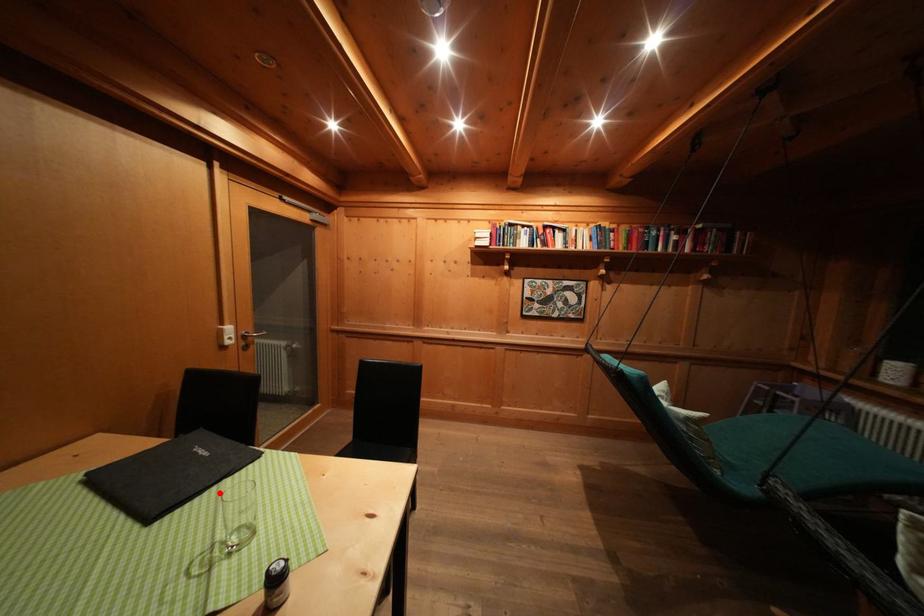
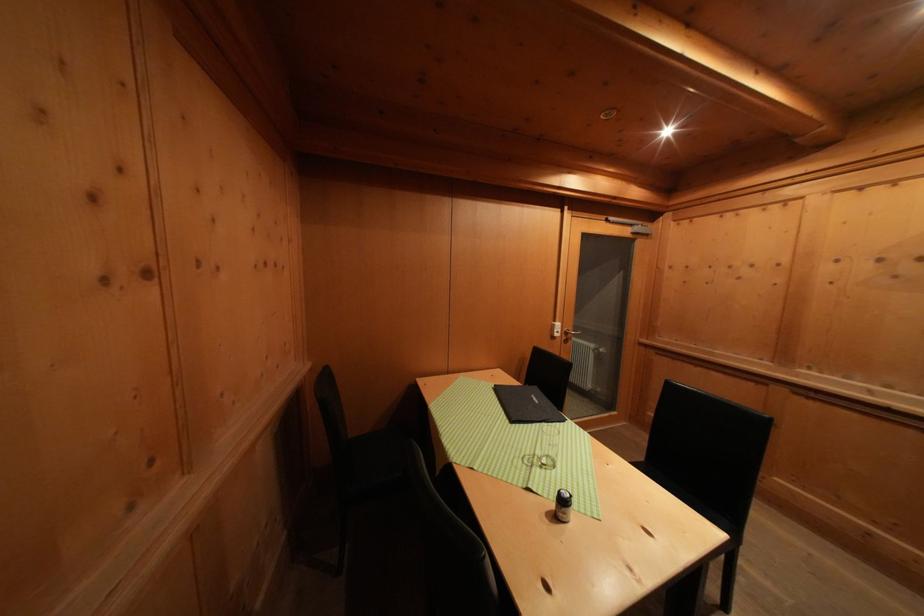
Find the pixel in the second image that matches the highlighted location in the first image.

(543, 429)